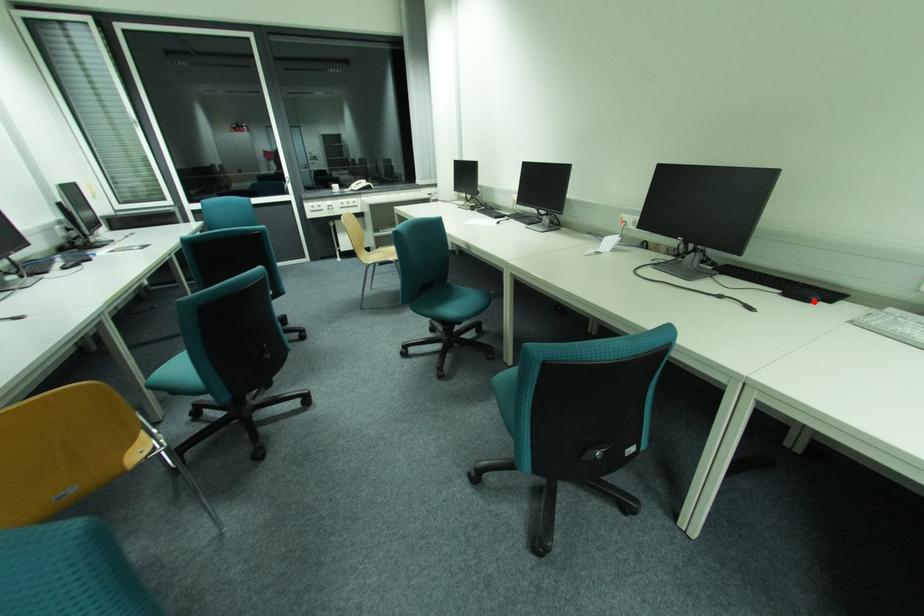
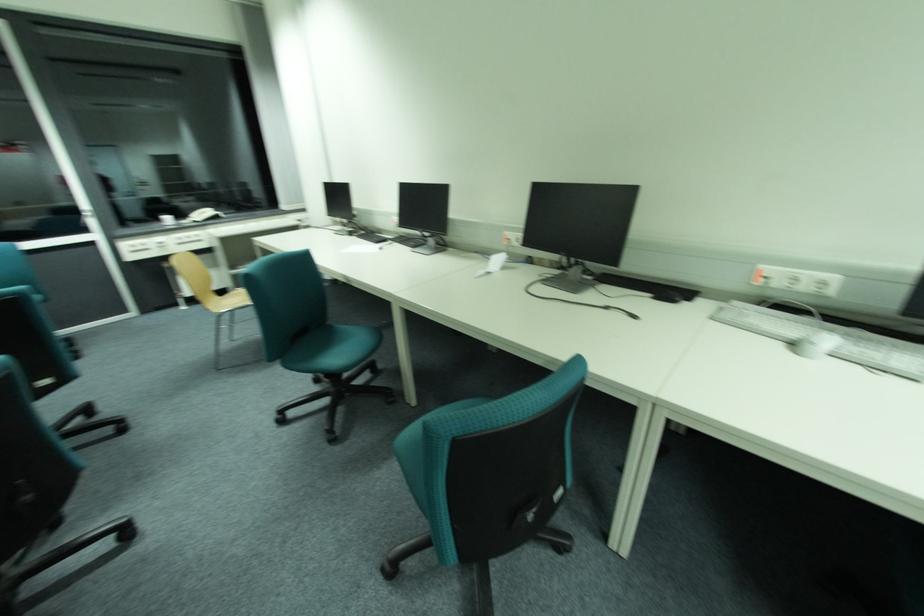
Find the pixel in the second image that matches the highlighted location in the first image.

(678, 302)